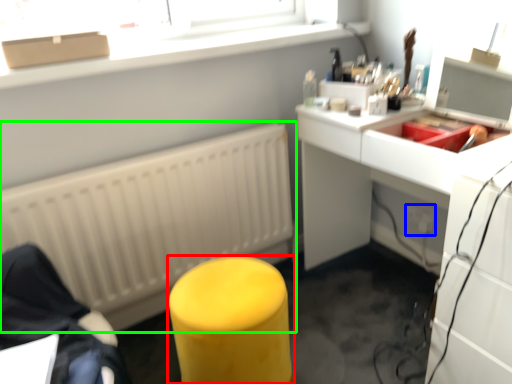
Question: Which is nearer to the furniture (highlighted by a red box)? electric outlet (highlighted by a blue box) or radiator (highlighted by a green box).

Choices:
 (A) electric outlet
 (B) radiator

Answer: (B)